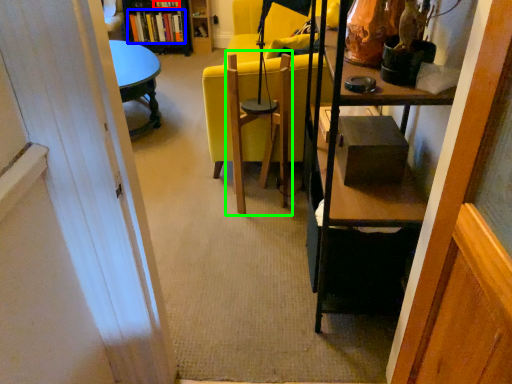
Question: Which is nearer to the book (highlighted by a red box)? book (highlighted by a blue box) or swivel chair (highlighted by a green box).

Choices:
 (A) book
 (B) swivel chair

Answer: (A)